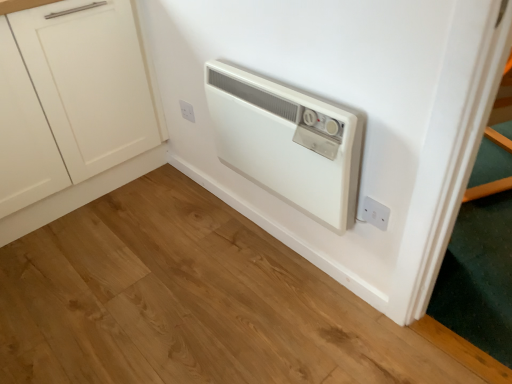
Question: Can you confirm if white plastic heater at center is taller than white plastic electric outlet at upper center, arranged as the second electric outlet when viewed from the right?

Choices:
 (A) yes
 (B) no

Answer: (A)

Question: From the image's perspective, is white plastic heater at center over white plastic electric outlet at upper center, positioned as the first electric outlet in left-to-right order?

Choices:
 (A) yes
 (B) no

Answer: (B)

Question: Is white plastic heater at center in front of white plastic electric outlet at upper center, positioned as the 1th electric outlet in top-to-bottom order?

Choices:
 (A) yes
 (B) no

Answer: (A)

Question: Is white plastic electric outlet at upper center, arranged as the second electric outlet when viewed from the right, at the back of white plastic heater at center?

Choices:
 (A) yes
 (B) no

Answer: (B)

Question: Can you confirm if white plastic heater at center is smaller than white plastic electric outlet at upper center, arranged as the second electric outlet when viewed from the right?

Choices:
 (A) no
 (B) yes

Answer: (A)

Question: Do you think white plastic electric outlet at upper center, which is counted as the 2th electric outlet, starting from the bottom, is within white matte cabinet at left, or outside of it?

Choices:
 (A) outside
 (B) inside

Answer: (A)

Question: Looking at their shapes, would you say white plastic electric outlet at upper center, arranged as the second electric outlet when viewed from the right, is wider or thinner than white matte cabinet at left?

Choices:
 (A) wide
 (B) thin

Answer: (B)

Question: From the image's perspective, is white plastic electric outlet at upper center, which is counted as the first electric outlet, starting from the back, positioned above or below white matte cabinet at left?

Choices:
 (A) below
 (B) above

Answer: (A)

Question: Considering the positions of point (181, 99) and point (74, 200), is point (181, 99) closer or farther from the camera than point (74, 200)?

Choices:
 (A) closer
 (B) farther

Answer: (A)

Question: Is white plastic electric outlet at upper center, which is counted as the first electric outlet, starting from the back, spatially inside white plastic electric outlet at lower right, which is the 2th electric outlet in left-to-right order, or outside of it?

Choices:
 (A) inside
 (B) outside

Answer: (B)

Question: Considering their positions, is white plastic electric outlet at upper center, arranged as the second electric outlet when viewed from the right, located in front of or behind white plastic electric outlet at lower right, the 1th electric outlet in the front-to-back sequence?

Choices:
 (A) behind
 (B) front

Answer: (A)

Question: From the image's perspective, relative to white plastic electric outlet at lower right, marked as the 1th electric outlet in a bottom-to-top arrangement, is white plastic electric outlet at upper center, arranged as the second electric outlet when viewed from the right, above or below?

Choices:
 (A) above
 (B) below

Answer: (A)

Question: Considering the positions of white plastic electric outlet at upper center, placed as the second electric outlet when sorted from front to back, and white plastic electric outlet at lower right, which is the 2th electric outlet in left-to-right order, in the image, is white plastic electric outlet at upper center, placed as the second electric outlet when sorted from front to back, bigger or smaller than white plastic electric outlet at lower right, which is the 2th electric outlet in left-to-right order,?

Choices:
 (A) big
 (B) small

Answer: (A)

Question: From the image's perspective, is white plastic electric outlet at upper center, which is counted as the 2th electric outlet, starting from the bottom, positioned above or below white plastic heater at center?

Choices:
 (A) below
 (B) above

Answer: (B)

Question: Looking at their shapes, would you say white plastic electric outlet at upper center, placed as the second electric outlet when sorted from front to back, is wider or thinner than white plastic heater at center?

Choices:
 (A) thin
 (B) wide

Answer: (A)